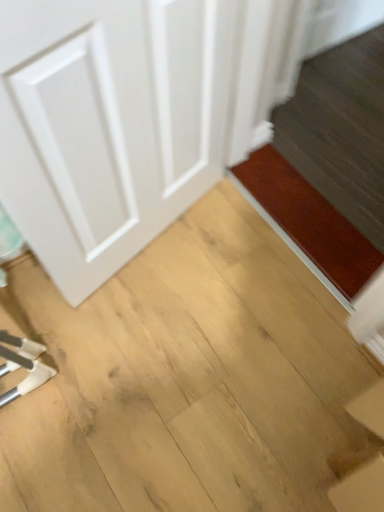
Question: Should I look upward or downward to see light brown wood at center?

Choices:
 (A) down
 (B) up

Answer: (A)

Question: From the image's perspective, would you say light brown wood at center is shown under brown matte doormat at lower right?

Choices:
 (A) yes
 (B) no

Answer: (A)

Question: Does light brown wood at center contain brown matte doormat at lower right?

Choices:
 (A) yes
 (B) no

Answer: (B)

Question: From a real-world perspective, is light brown wood at center under brown matte doormat at lower right?

Choices:
 (A) no
 (B) yes

Answer: (B)

Question: Considering the relative sizes of light brown wood at center and brown matte doormat at lower right in the image provided, is light brown wood at center wider than brown matte doormat at lower right?

Choices:
 (A) yes
 (B) no

Answer: (A)

Question: Considering the relative sizes of light brown wood at center and brown matte doormat at lower right in the image provided, is light brown wood at center shorter than brown matte doormat at lower right?

Choices:
 (A) no
 (B) yes

Answer: (A)

Question: Is light brown wood at center turned away from brown matte doormat at lower right?

Choices:
 (A) yes
 (B) no

Answer: (B)

Question: Is light brown wood at center far away from white matte door at left?

Choices:
 (A) no
 (B) yes

Answer: (A)

Question: From the image's perspective, is light brown wood at center on white matte door at left?

Choices:
 (A) yes
 (B) no

Answer: (B)

Question: Can you confirm if light brown wood at center is smaller than white matte door at left?

Choices:
 (A) no
 (B) yes

Answer: (A)

Question: Can you confirm if light brown wood at center is bigger than white matte door at left?

Choices:
 (A) no
 (B) yes

Answer: (B)

Question: From a real-world perspective, is light brown wood at center located beneath white matte door at left?

Choices:
 (A) yes
 (B) no

Answer: (A)

Question: Does light brown wood at center contain white matte door at left?

Choices:
 (A) yes
 (B) no

Answer: (B)

Question: Considering the relative positions of brown matte doormat at lower right and light brown wood at center in the image provided, is brown matte doormat at lower right to the left of light brown wood at center from the viewer's perspective?

Choices:
 (A) no
 (B) yes

Answer: (A)